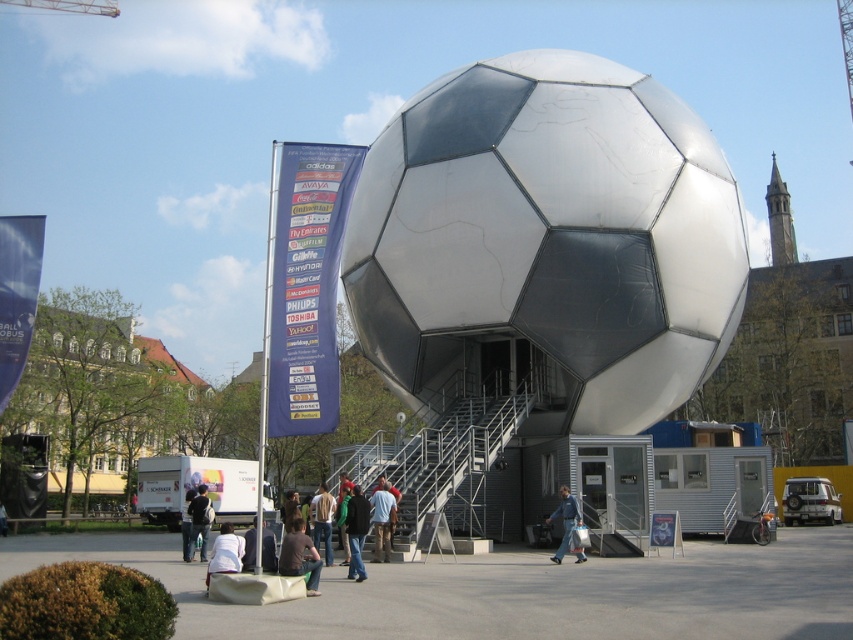
Can you confirm if denim jacket at lower center is bigger than dark blue backpack at center?

Actually, denim jacket at lower center might be smaller than dark blue backpack at center.

Can you confirm if denim jacket at lower center is wider than dark blue backpack at center?

Incorrect, denim jacket at lower center's width does not surpass dark blue backpack at center's.

The image size is (853, 640). What are the coordinates of `denim jacket at lower center` in the screenshot? It's located at (566, 520).

Where is `denim jacket at lower center`? This screenshot has width=853, height=640. denim jacket at lower center is located at coordinates (566, 520).